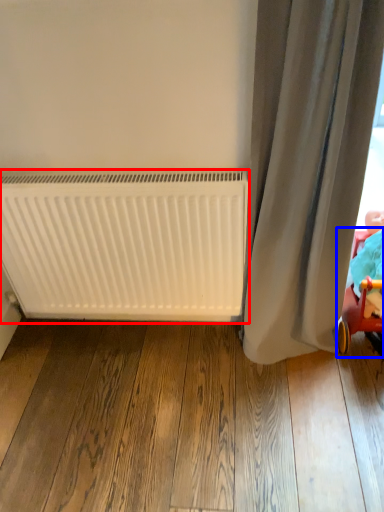
Question: Which object is closer to the camera taking this photo, radiator (highlighted by a red box) or baby carriage (highlighted by a blue box)?

Choices:
 (A) radiator
 (B) baby carriage

Answer: (B)